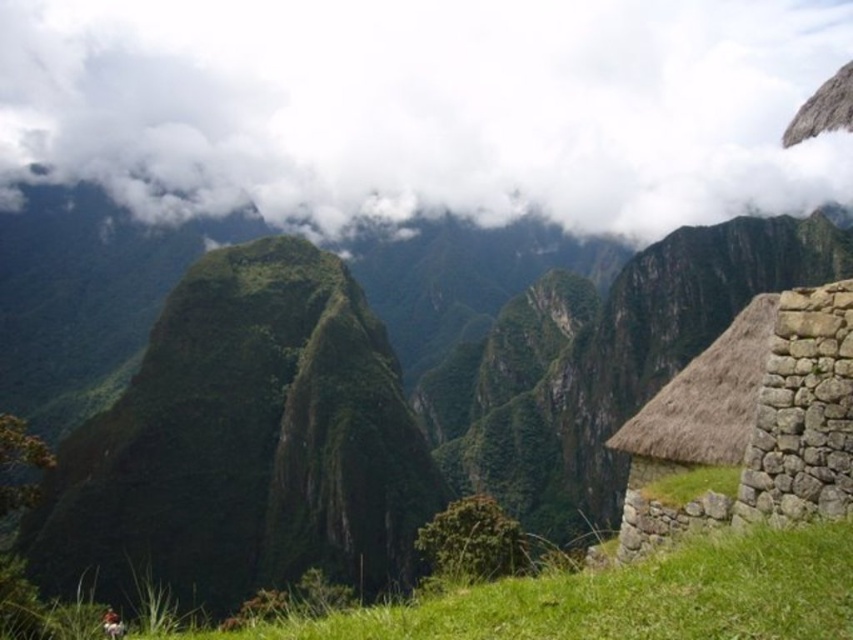
Does white fluffy cloud at upper center have a lesser width compared to brown thatch hut at right?

In fact, white fluffy cloud at upper center might be wider than brown thatch hut at right.

Does white fluffy cloud at upper center have a smaller size compared to brown thatch hut at right?

No.

The width and height of the screenshot is (853, 640). What do you see at coordinates (426, 108) in the screenshot? I see `white fluffy cloud at upper center` at bounding box center [426, 108].

I want to click on white fluffy cloud at upper center, so click(426, 108).

Who is shorter, green grassy at lower center or brown thatch hut at right?

With less height is green grassy at lower center.

In the scene shown: Can you confirm if green grassy at lower center is shorter than brown thatch hut at right?

Yes.

You are a GUI agent. You are given a task and a screenshot of the screen. Output one action in this format:
    pyautogui.click(x=<x>, y=<y>)
    Task: Click on the green grassy at lower center
    This screenshot has width=853, height=640.
    Given the screenshot: What is the action you would take?
    pyautogui.click(x=631, y=596)

This screenshot has width=853, height=640. I want to click on green grassy at lower center, so click(631, 596).

Who is taller, white fluffy cloud at upper center or green grassy at lower center?

white fluffy cloud at upper center is taller.

Between point (293, 154) and point (699, 586), which one is positioned in front?

Point (699, 586) is in front.

Find the location of `white fluffy cloud at upper center`. white fluffy cloud at upper center is located at coordinates (426, 108).